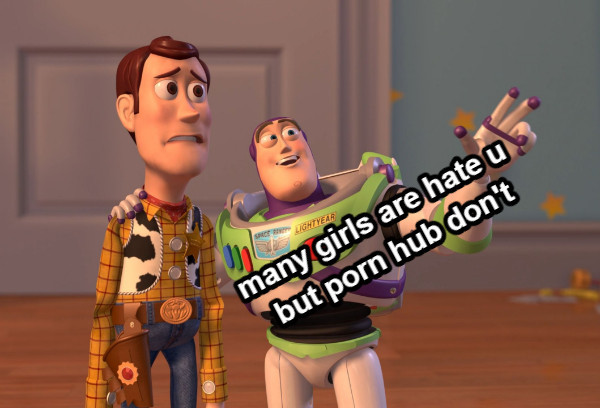
I want to click on white trim, so click(370, 64), click(461, 280).